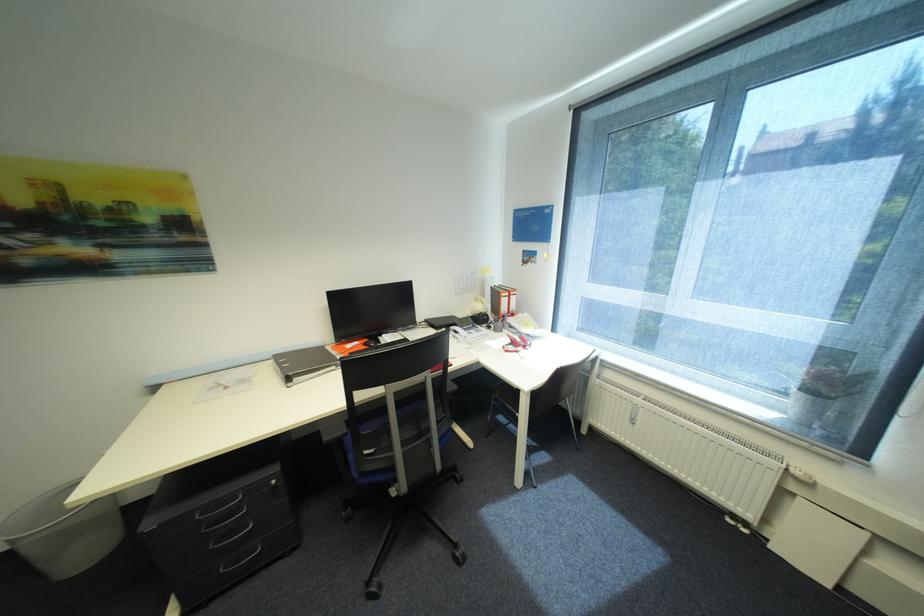
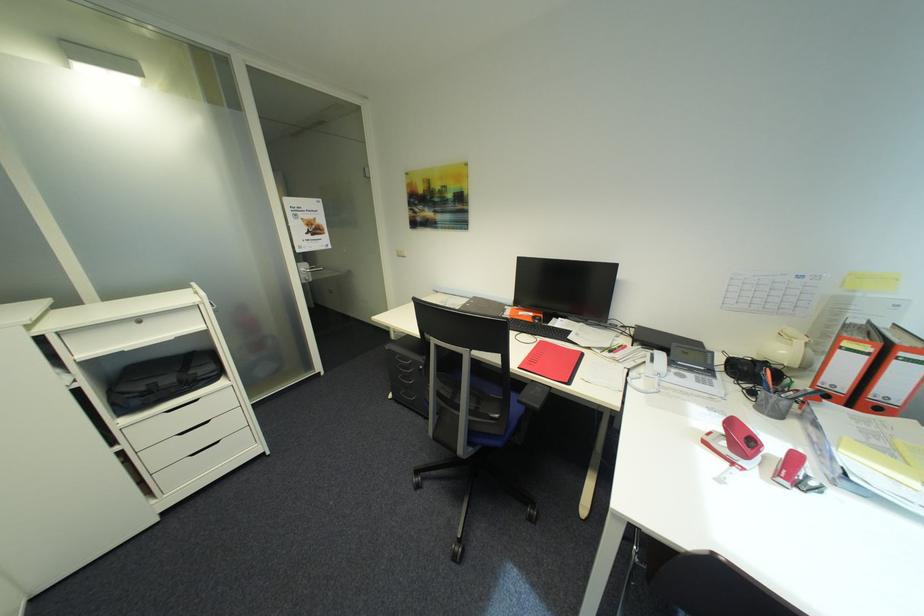
Where in the second image is the point corresponding to point (521, 300) from the first image?

(912, 371)